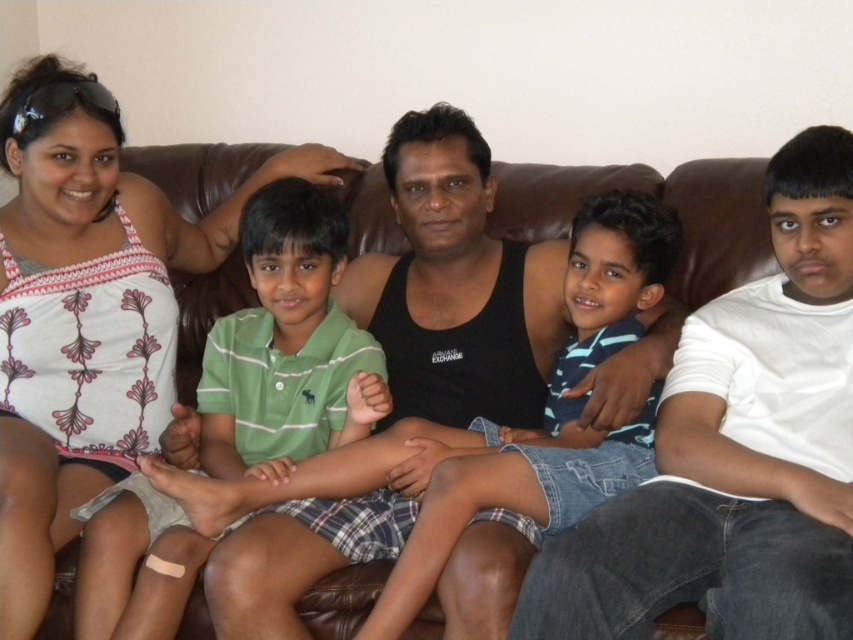
How much distance is there between white printed tank top at upper left and striped cotton shirt at center?

white printed tank top at upper left and striped cotton shirt at center are 30.82 inches apart.

Between white printed tank top at upper left and striped cotton shirt at center, which one has less height?

With less height is striped cotton shirt at center.

At what (x,y) coordinates should I click in order to perform the action: click on white printed tank top at upper left. Please return your answer as a coordinate pair (x, y). This screenshot has width=853, height=640. Looking at the image, I should click on (86, 310).

Identify the location of white printed tank top at upper left. (86, 310).

The image size is (853, 640). Describe the element at coordinates (737, 451) in the screenshot. I see `blue denim shorts at center` at that location.

Who is positioned more to the left, blue denim shorts at center or striped cotton shirt at center?

striped cotton shirt at center

Which is in front, point (722, 330) or point (621, 278)?

Point (722, 330)

Identify the location of blue denim shorts at center. (737, 451).

Does blue denim shorts at center have a greater height compared to white printed tank top at upper left?

No, blue denim shorts at center is not taller than white printed tank top at upper left.

Based on the photo, does blue denim shorts at center have a larger size compared to white printed tank top at upper left?

Actually, blue denim shorts at center might be smaller than white printed tank top at upper left.

Between point (547, 561) and point (85, 209), which one is positioned in front?

Point (547, 561) is in front.

Find the location of a particular element. Image resolution: width=853 pixels, height=640 pixels. blue denim shorts at center is located at coordinates (737, 451).